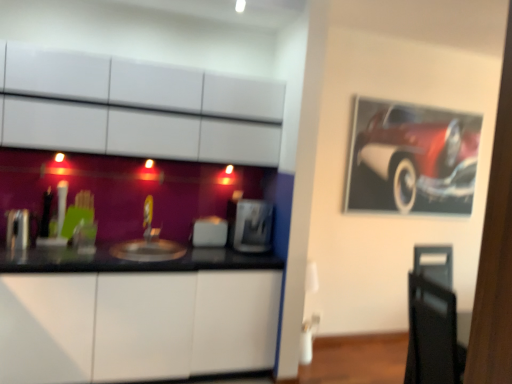
The height and width of the screenshot is (384, 512). Identify the location of free space above shiny red car at upper right (from a real-world perspective). (424, 102).